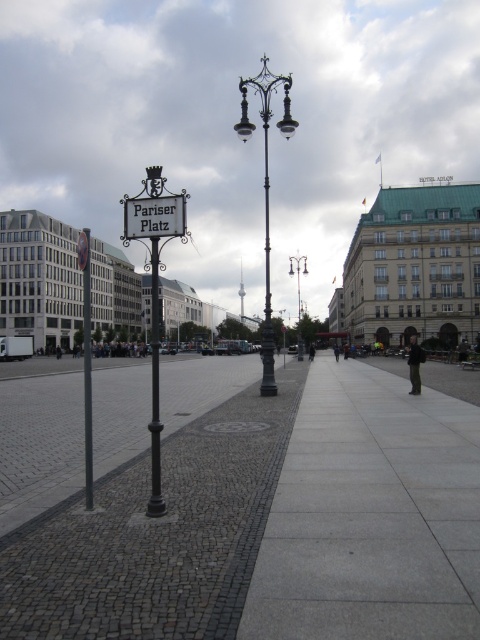
Between point (156, 216) and point (294, 273), which one is positioned in front?

Point (156, 216) is more forward.

Who is more distant from viewer, (x=141, y=208) or (x=289, y=257)?

Positioned behind is point (x=289, y=257).

Find the location of a particular element. The height and width of the screenshot is (640, 480). white wooden sign at center-left is located at coordinates (155, 216).

Between point (348, 464) and point (162, 220), which one is positioned behind?

The point (348, 464) is more distant.

Which is more to the left, gray cobblestone pavement at center or white metal sign at center-left?

From the viewer's perspective, white metal sign at center-left appears more on the left side.

Where is `gray cobblestone pavement at center`? gray cobblestone pavement at center is located at coordinates (240, 506).

Find the location of a particular element. This screenshot has height=640, width=480. gray cobblestone pavement at center is located at coordinates (240, 506).

Does gray cobblestone pavement at center have a smaller size compared to polished metal signpost at center-left?

Yes.

Between gray cobblestone pavement at center and polished metal signpost at center-left, which one has less height?

Standing shorter between the two is gray cobblestone pavement at center.

Between point (477, 545) and point (87, 237), which one is positioned behind?

Positioned behind is point (87, 237).

At what (x,y) coordinates should I click in order to perform the action: click on gray cobblestone pavement at center. Please return your answer as a coordinate pair (x, y). The image size is (480, 640). Looking at the image, I should click on [x=240, y=506].